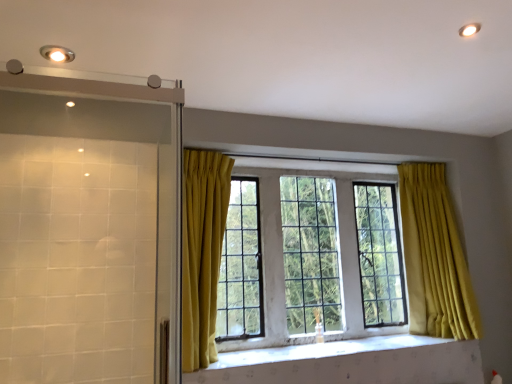
Image resolution: width=512 pixels, height=384 pixels. Find the location of `vacant space to the left of white glossy light fixture at upper right`. vacant space to the left of white glossy light fixture at upper right is located at coordinates (434, 31).